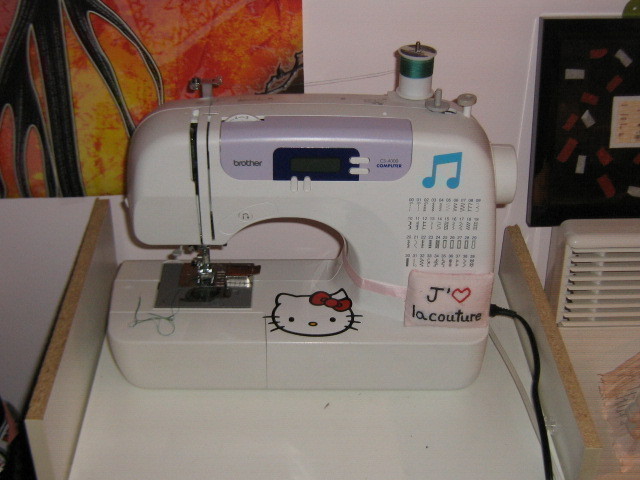
This screenshot has width=640, height=480. I want to click on sewing machine, so click(371, 200).